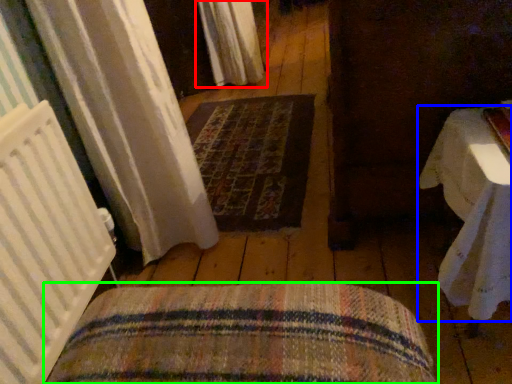
Question: Based on their relative distances, which object is nearer to curtain (highlighted by a red box)? Choose from table (highlighted by a blue box) and furniture (highlighted by a green box).

Choices:
 (A) table
 (B) furniture

Answer: (A)